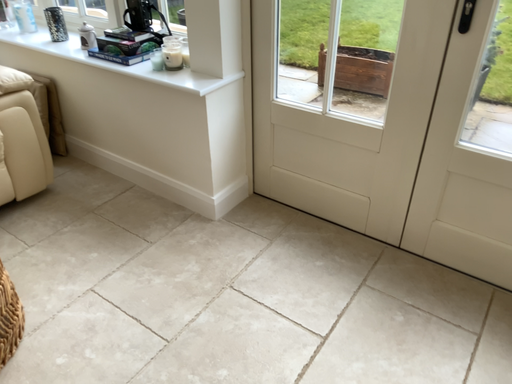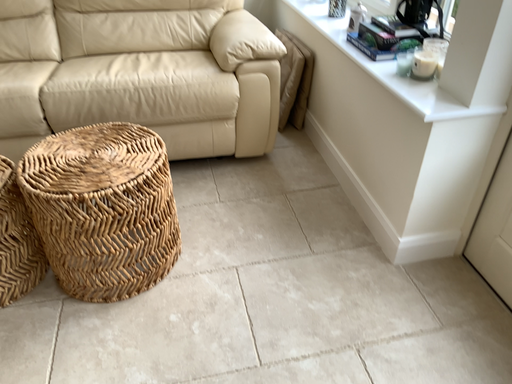
Question: How did the camera likely rotate when shooting the video?

Choices:
 (A) rotated left
 (B) rotated right

Answer: (A)